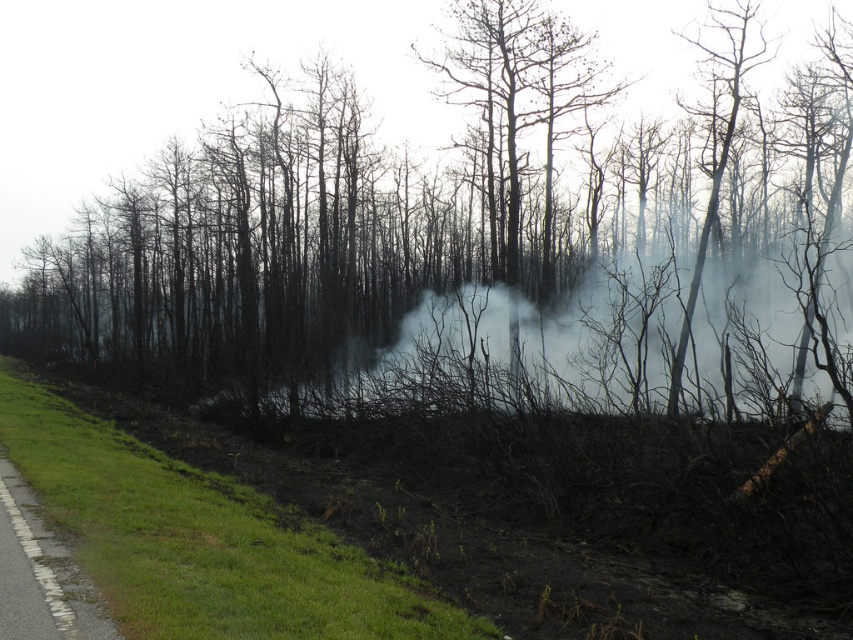
You are a firefighter assessing the scene. You notice the charcoal bark tree at center and the white smoke at center. Which object takes up more space in the image?

The charcoal bark tree at center has a larger size compared to the white smoke at center, so it takes up more space in the image.